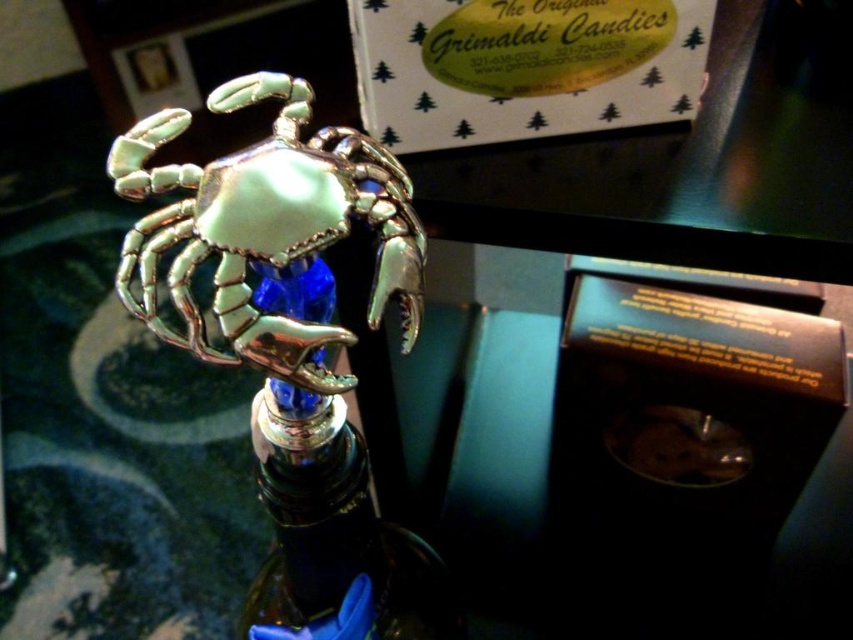
Who is more distant from viewer, (235, 97) or (361, 522)?

Positioned behind is point (361, 522).

Does point (170, 234) come closer to viewer compared to point (312, 440)?

Yes, point (170, 234) is closer to viewer.

Who is more forward, (x=335, y=189) or (x=427, y=563)?

Positioned in front is point (x=335, y=189).

Find the location of a particular element. This screenshot has width=853, height=640. shiny silver crab at center is located at coordinates (267, 227).